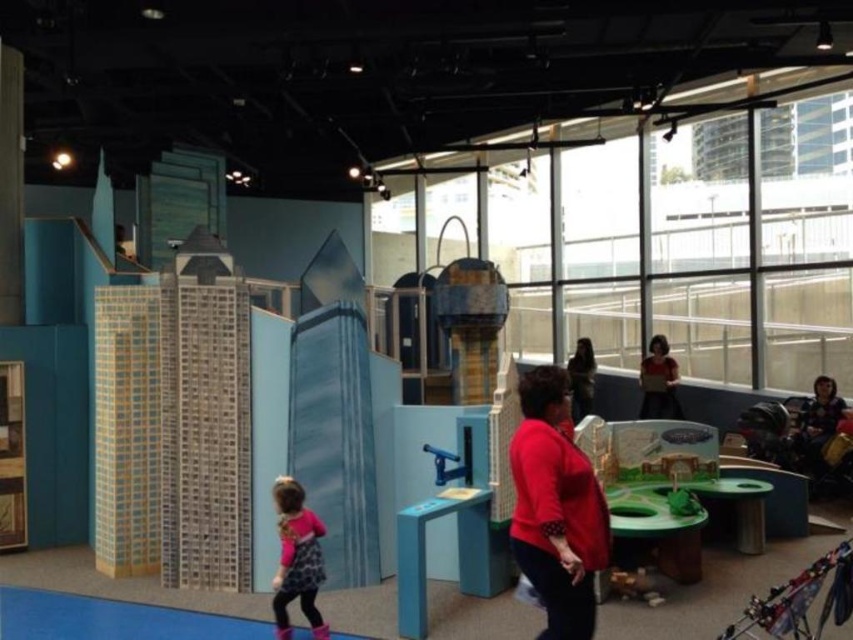
Looking at this image, can you confirm if matte red sweater at center is positioned above matte red shirt at upper right?

Yes, matte red sweater at center is above matte red shirt at upper right.

Does matte red sweater at center come behind matte red shirt at upper right?

No.

Locate an element on the screen. matte red sweater at center is located at coordinates (555, 508).

I want to click on matte red sweater at center, so click(555, 508).

How much distance is there between matte red shirt at upper right and dark brown hair at center?

matte red shirt at upper right is 39.28 inches away from dark brown hair at center.

Who is lower down, matte red shirt at upper right or dark brown hair at center?

Positioned lower is dark brown hair at center.

Who is more forward, (665, 344) or (581, 369)?

Point (665, 344) is in front.

This screenshot has width=853, height=640. I want to click on matte red shirt at upper right, so click(x=659, y=381).

Is matte red sweater at center in front of blue plastic lever at center?

Yes, matte red sweater at center is in front of blue plastic lever at center.

Who is shorter, matte red sweater at center or blue plastic lever at center?

blue plastic lever at center is shorter.

This screenshot has height=640, width=853. What are the coordinates of `matte red sweater at center` in the screenshot? It's located at (555, 508).

You are a GUI agent. You are given a task and a screenshot of the screen. Output one action in this format:
    pyautogui.click(x=<x>, y=<y>)
    Task: Click on the matte red sweater at center
    
    Given the screenshot: What is the action you would take?
    pyautogui.click(x=555, y=508)